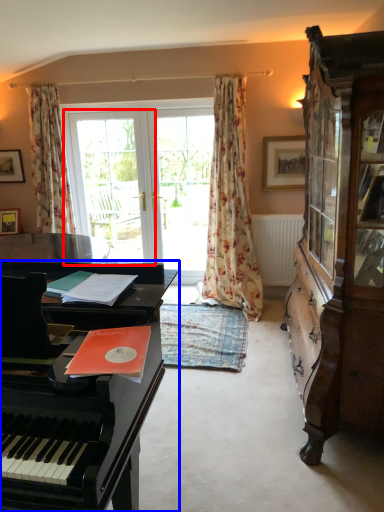
Question: Which of the following is the closest to the observer, screen door (highlighted by a red box) or piano (highlighted by a blue box)?

Choices:
 (A) screen door
 (B) piano

Answer: (B)